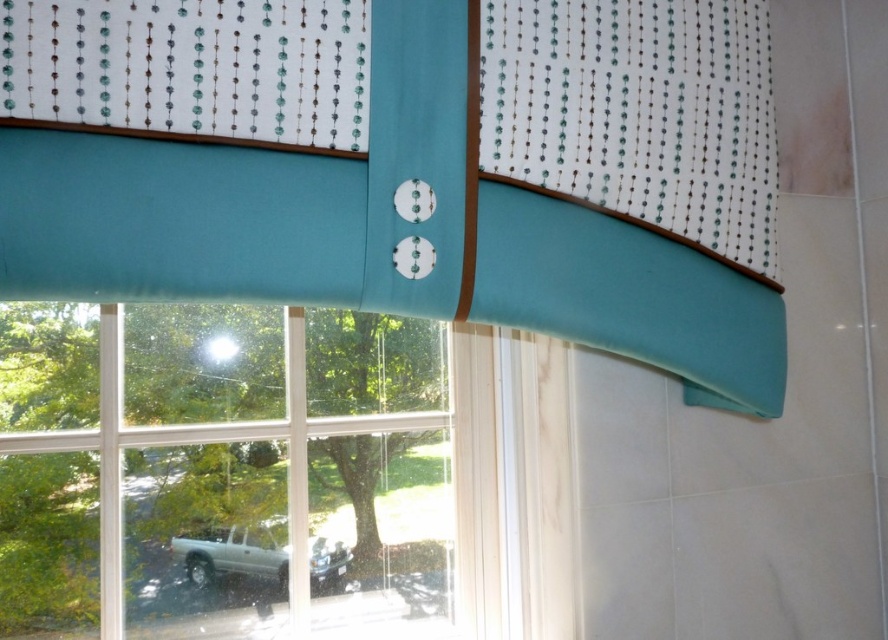
In the scene shown: You are an interior designer assessing the window decor. You need to determine if the teal fabric valance at upper center can be fully seen without overlapping the clear glass window at center. Based on their sizes, what would you conclude?

The teal fabric valance at upper center is bigger than the clear glass window at center, so it may overlap the window, making it impossible to see the valance fully without obstruction.

You are standing in a room and want to see outside through the clear glass window at center. Is the teal fabric valance at upper center blocking your view?

The teal fabric valance at upper center is located above the clear glass window at center, so it is blocking part of your view of the window.

You are looking at the window with the teal fabric valance at upper center. There is a point marked at coordinates (x=409, y=166). Can you determine what object is located at that point?

The point at coordinates (x=409, y=166) marks the teal fabric valance at upper center.